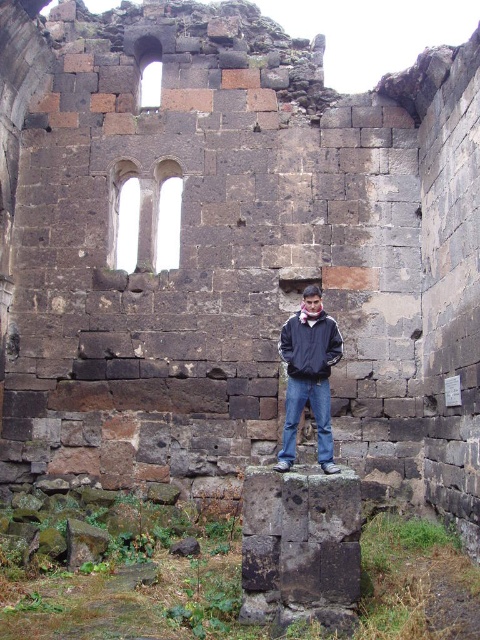
You are standing at the point labeled point (308, 378) in the ancient stone structure. You want to move towards the person on the pedestal. Which direction should you move relative to point (316, 404)?

You should move towards point (316, 404) because it is in front of point (308, 378), so moving towards it will lead you toward the person on the pedestal.